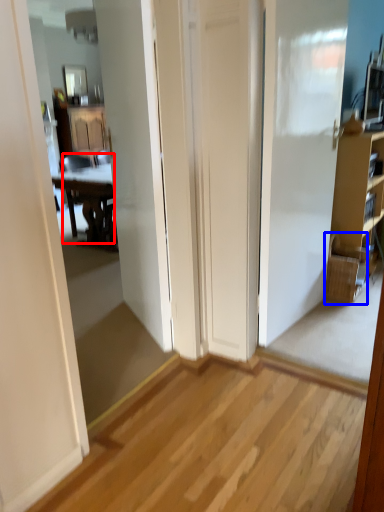
Question: Which of the following is the closest to the observer, chair (highlighted by a red box) or picnic basket (highlighted by a blue box)?

Choices:
 (A) chair
 (B) picnic basket

Answer: (B)